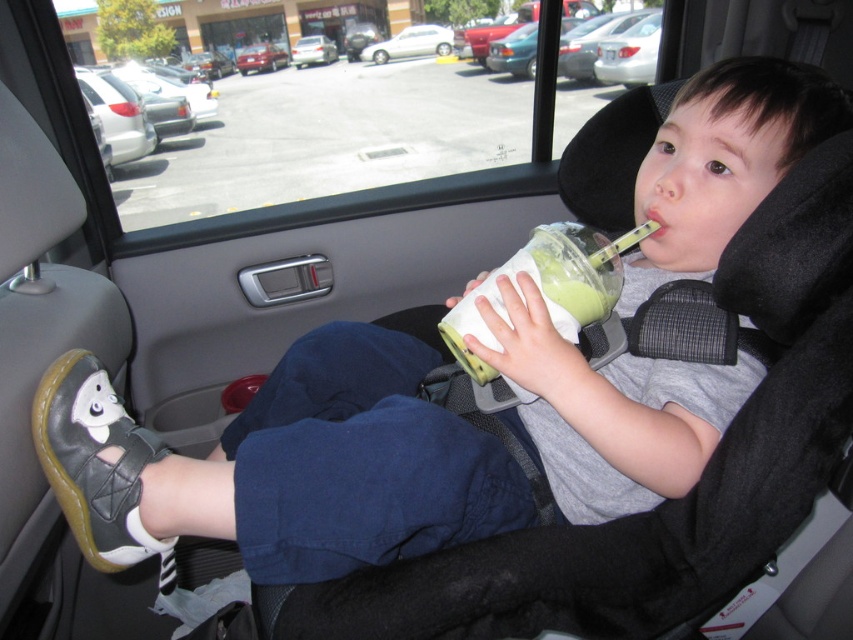
Question: Is white matte car at center positioned at the back of white plastic car at center?

Choices:
 (A) no
 (B) yes

Answer: (A)

Question: Which object is positioned farthest from the metallic red car at center?

Choices:
 (A) white plastic car at center
 (B) white matte car at center

Answer: (B)

Question: Which point is farther from the camera taking this photo?

Choices:
 (A) (416, 28)
 (B) (328, 38)
 (C) (267, 61)

Answer: (B)

Question: Can you confirm if white matte car at center is smaller than metallic red car at center?

Choices:
 (A) no
 (B) yes

Answer: (A)

Question: Which point is closer to the camera taking this photo?

Choices:
 (A) (247, 56)
 (B) (370, 61)
 (C) (328, 60)

Answer: (C)

Question: Can you confirm if white matte car at center is positioned to the right of metallic red car at center?

Choices:
 (A) yes
 (B) no

Answer: (A)